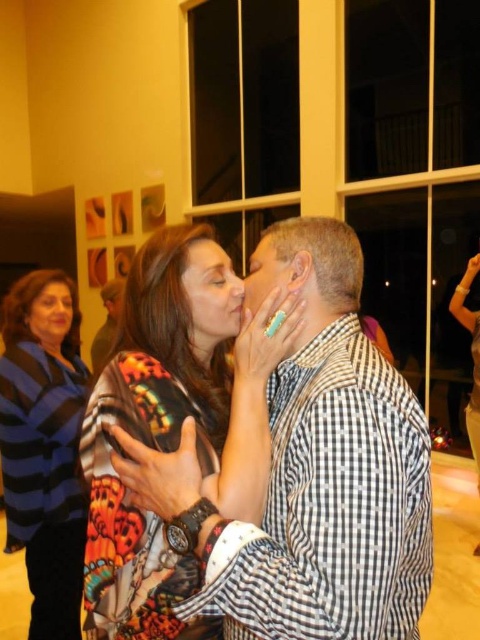
You are a photographer at the event and want to capture a photo of both the printed silk blouse at center and the blue striped sweater at left. Based on their positions, which item should you focus on first to ensure both are in frame?

The printed silk blouse at center is to the right of the blue striped sweater at left. To capture both in frame, focus on the blue striped sweater at left first, then adjust to include the printed silk blouse at center to the right.

You are a photographer adjusting the focus on your camera. You want to ensure both the blue striped sweater at left and the matte black face at upper left are in sharp focus. Which object should you focus on first to achieve this?

You should focus on the blue striped sweater at left first because it is closer to the viewer than the matte black face at upper left. By focusing on the closer object, the farther object will also be in focus if within the depth of field.